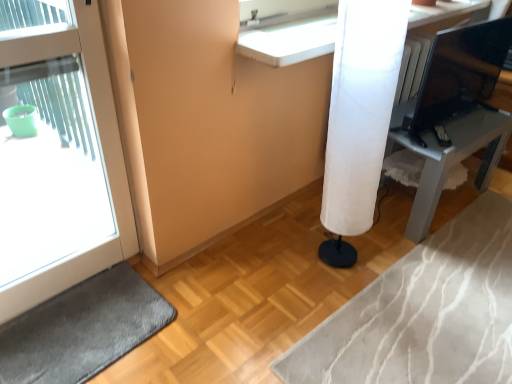
Question: Can you confirm if white glossy door at left is bigger than dark gray carpet at lower left?

Choices:
 (A) yes
 (B) no

Answer: (A)

Question: Is white glossy door at left at the right side of dark gray carpet at lower left?

Choices:
 (A) no
 (B) yes

Answer: (A)

Question: Are white glossy door at left and dark gray carpet at lower left located far from each other?

Choices:
 (A) no
 (B) yes

Answer: (A)

Question: Does white glossy door at left have a greater width compared to dark gray carpet at lower left?

Choices:
 (A) yes
 (B) no

Answer: (B)

Question: From a real-world perspective, is white glossy door at left below dark gray carpet at lower left?

Choices:
 (A) yes
 (B) no

Answer: (B)

Question: Does white glossy door at left have a lesser height compared to dark gray carpet at lower left?

Choices:
 (A) yes
 (B) no

Answer: (B)

Question: Are white glossy counter at upper center and white fabric lampshade at center-right beside each other?

Choices:
 (A) yes
 (B) no

Answer: (B)

Question: Is the position of white glossy counter at upper center less distant than that of white fabric lampshade at center-right?

Choices:
 (A) no
 (B) yes

Answer: (A)

Question: Does white glossy counter at upper center appear on the left side of white fabric lampshade at center-right?

Choices:
 (A) yes
 (B) no

Answer: (B)

Question: Is white glossy counter at upper center aimed at white fabric lampshade at center-right?

Choices:
 (A) no
 (B) yes

Answer: (A)

Question: From the image's perspective, is white glossy counter at upper center below white fabric lampshade at center-right?

Choices:
 (A) yes
 (B) no

Answer: (B)

Question: Is white glossy counter at upper center shorter than white fabric lampshade at center-right?

Choices:
 (A) no
 (B) yes

Answer: (B)

Question: Can you confirm if white fabric lamp at right is taller than white fabric lampshade at center-right?

Choices:
 (A) yes
 (B) no

Answer: (B)